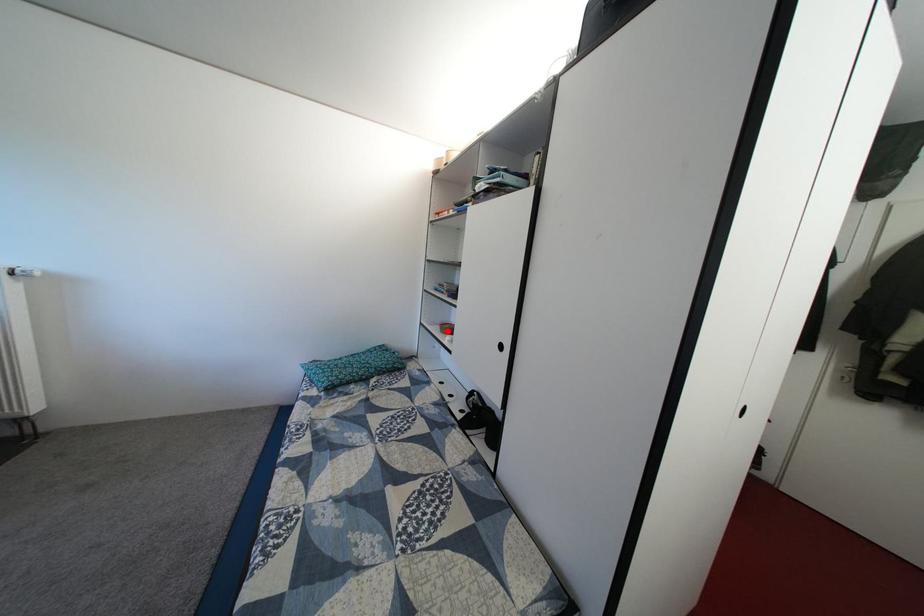
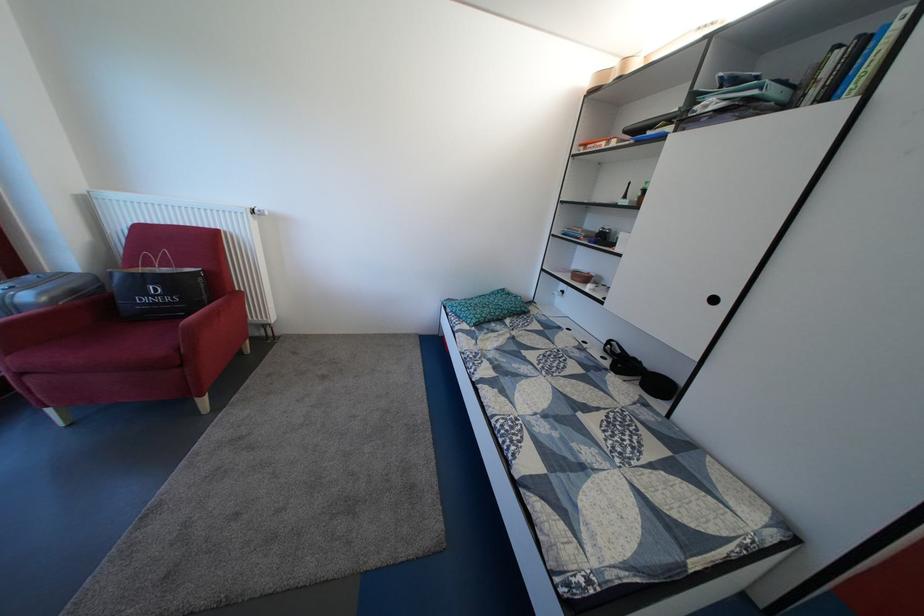
The point at the highlighted location is marked in the first image. Where is the corresponding point in the second image?

(570, 278)